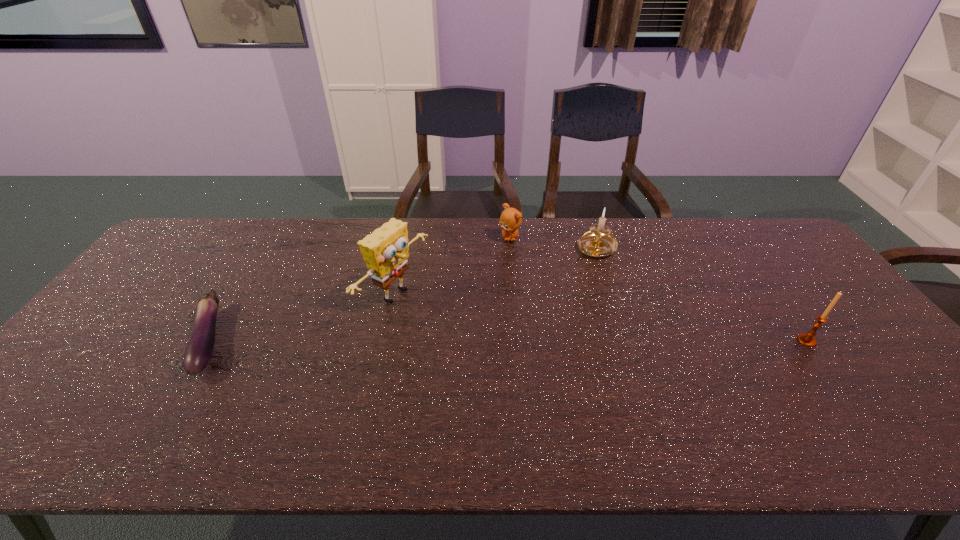
Locate an element on the screen. The height and width of the screenshot is (540, 960). free point located 0.330m on the handle side of the second object from right to left is located at coordinates (534, 319).

The height and width of the screenshot is (540, 960). Identify the location of teddy bear that is at the far edge. (510, 219).

What are the coordinates of `candle holder that is at the far edge` in the screenshot? It's located at (598, 242).

Identify the location of object at the near edge. This screenshot has width=960, height=540. (198, 352).

Image resolution: width=960 pixels, height=540 pixels. I want to click on object located at the right edge, so click(x=808, y=339).

Find the location of a particular element. The width and height of the screenshot is (960, 540). vacant space at the far edge is located at coordinates (342, 248).

Identify the location of vacant point at the near edge. (647, 406).

In the image, there is a desktop. At what (x,y) coordinates should I click in order to perform the action: click on free space at the left edge. Please return your answer as a coordinate pair (x, y). The height and width of the screenshot is (540, 960). Looking at the image, I should click on (82, 368).

In the image, there is a desktop. At what (x,y) coordinates should I click in order to perform the action: click on vacant region at the right edge. Please return your answer as a coordinate pair (x, y). This screenshot has width=960, height=540. Looking at the image, I should click on (776, 287).

In the image, there is a desktop. Where is `vacant space at the far left corner`? The image size is (960, 540). vacant space at the far left corner is located at coordinates (204, 235).